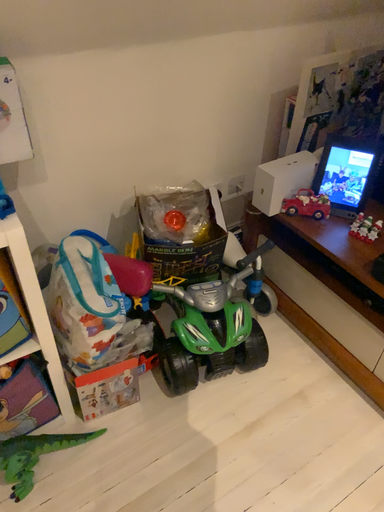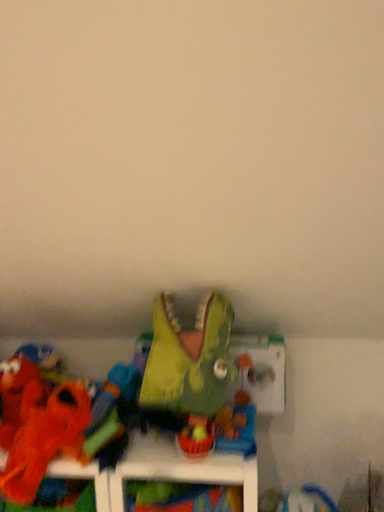
Question: How did the camera likely rotate when shooting the video?

Choices:
 (A) rotated downward
 (B) rotated upward

Answer: (B)